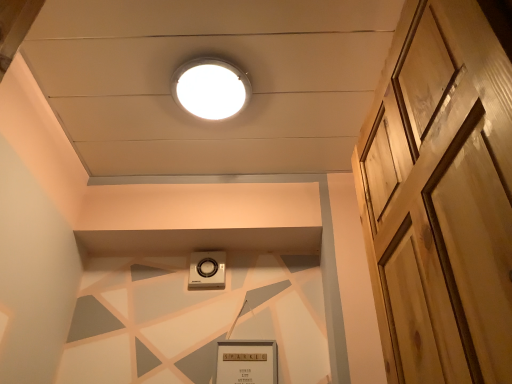
Question: From a real-world perspective, does white plastic thermostat at center stand above light brown wooden door at right?

Choices:
 (A) no
 (B) yes

Answer: (B)

Question: Considering the relative sizes of white plastic thermostat at center and light brown wooden door at right in the image provided, is white plastic thermostat at center bigger than light brown wooden door at right?

Choices:
 (A) yes
 (B) no

Answer: (B)

Question: Can you confirm if white plastic thermostat at center is positioned to the left of light brown wooden door at right?

Choices:
 (A) yes
 (B) no

Answer: (A)

Question: From the image's perspective, is white plastic thermostat at center under light brown wooden door at right?

Choices:
 (A) yes
 (B) no

Answer: (A)

Question: Considering the relative sizes of white plastic thermostat at center and light brown wooden door at right in the image provided, is white plastic thermostat at center shorter than light brown wooden door at right?

Choices:
 (A) no
 (B) yes

Answer: (B)

Question: From a real-world perspective, relative to white glossy droplight at upper center, is light brown wooden door at right vertically above or below?

Choices:
 (A) below
 (B) above

Answer: (A)

Question: Is light brown wooden door at right situated inside white glossy droplight at upper center or outside?

Choices:
 (A) inside
 (B) outside

Answer: (B)

Question: Looking at their shapes, would you say light brown wooden door at right is wider or thinner than white glossy droplight at upper center?

Choices:
 (A) wide
 (B) thin

Answer: (B)

Question: Looking at the image, does light brown wooden door at right seem bigger or smaller compared to white glossy droplight at upper center?

Choices:
 (A) big
 (B) small

Answer: (A)

Question: In the image, is white plastic thermostat at center positioned in front of or behind light brown wooden door at right?

Choices:
 (A) front
 (B) behind

Answer: (B)

Question: Do you think white plastic thermostat at center is within light brown wooden door at right, or outside of it?

Choices:
 (A) inside
 (B) outside

Answer: (B)

Question: From the image's perspective, is white plastic thermostat at center positioned above or below light brown wooden door at right?

Choices:
 (A) above
 (B) below

Answer: (B)

Question: Looking at the image, does white plastic thermostat at center seem bigger or smaller compared to light brown wooden door at right?

Choices:
 (A) small
 (B) big

Answer: (A)

Question: Considering the positions of white glossy droplight at upper center and white plastic thermostat at center in the image, is white glossy droplight at upper center wider or thinner than white plastic thermostat at center?

Choices:
 (A) wide
 (B) thin

Answer: (A)

Question: Based on their positions, is white glossy droplight at upper center located to the left or right of white plastic thermostat at center?

Choices:
 (A) right
 (B) left

Answer: (A)